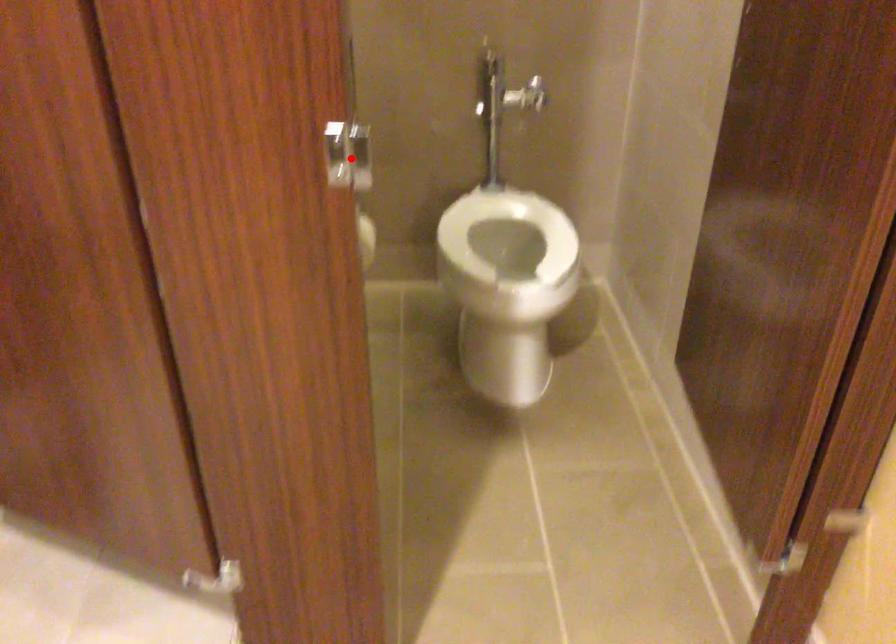
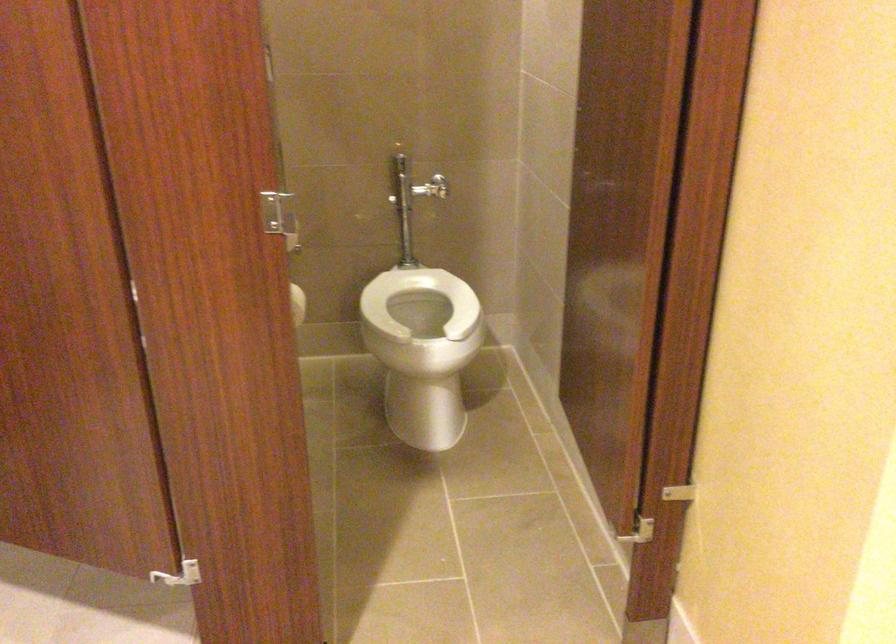
Where in the second image is the point corresponding to the highlighted location from the first image?

(279, 216)